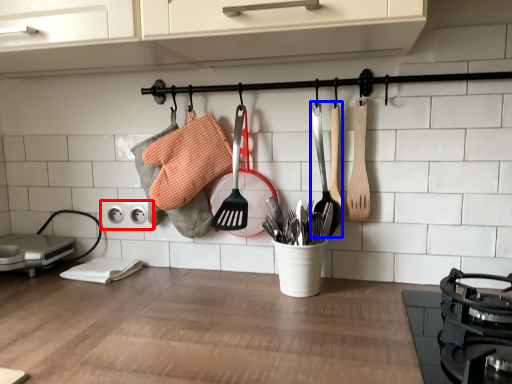
Question: Which point is closer to the camera, electric outlet (highlighted by a red box) or spatula (highlighted by a blue box)?

Choices:
 (A) electric outlet
 (B) spatula

Answer: (B)